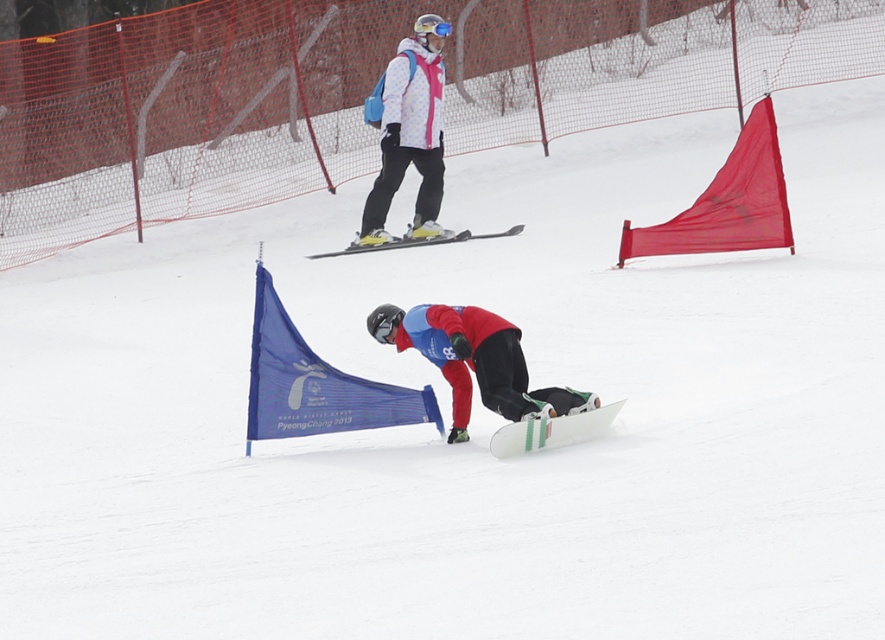
Who is positioned more to the left, red matte snowboard at center or matte pink jacket at upper center?

matte pink jacket at upper center

Which of these two, red matte snowboard at center or matte pink jacket at upper center, stands taller?

matte pink jacket at upper center is taller.

From the picture: Who is more distant from viewer, (x=491, y=340) or (x=355, y=236)?

Point (x=355, y=236)

You are a GUI agent. You are given a task and a screenshot of the screen. Output one action in this format:
    pyautogui.click(x=<x>, y=<y>)
    Task: Click on the red matte snowboard at center
    
    Given the screenshot: What is the action you would take?
    pyautogui.click(x=474, y=360)

Which is behind, point (399, 241) or point (447, 32)?

The point (399, 241) is behind.

What do you see at coordinates (416, 243) in the screenshot?
I see `yellow metallic skis at center` at bounding box center [416, 243].

Find the location of a particular element. yellow metallic skis at center is located at coordinates (416, 243).

Can you confirm if red matte snowboard at center is positioned above blue matte goggles at center?

No, red matte snowboard at center is not above blue matte goggles at center.

Who is taller, red matte snowboard at center or blue matte goggles at center?

With more height is red matte snowboard at center.

Between point (394, 344) and point (419, 36), which one is positioned in front?

Point (394, 344) is in front.

The width and height of the screenshot is (885, 640). Find the location of `red matte snowboard at center`. red matte snowboard at center is located at coordinates (474, 360).